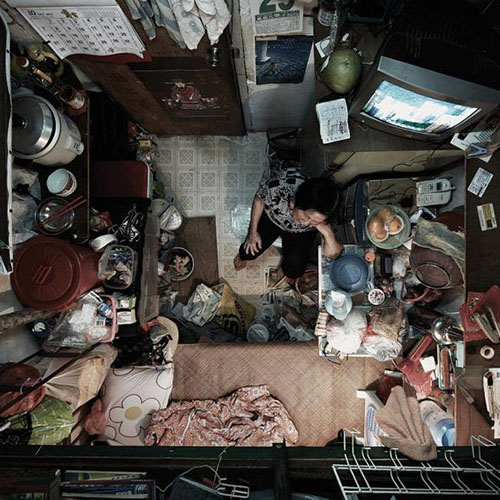
Identify the location of pillow. 149,392.